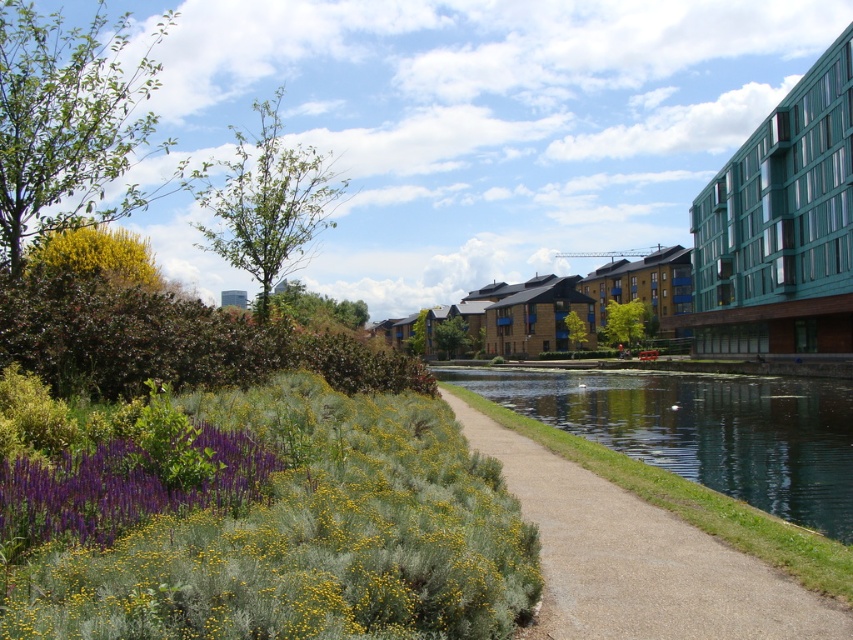
You are standing at the garden area on the left side of the park and want to reach the two points marked in the image. Which point, point (416, 564) or point (630, 605), is closer to you?

Point (416, 564) is closer to you than point (630, 605).

You are standing in the urban park and want to take a photo of the green fuzzy bush at lower left. If your camera has a maximum focus range of 30 feet, will you be able to capture it clearly?

The green fuzzy bush at lower left is 32.44 feet away from you, which exceeds the camera maximum focus range of 30 feet. Therefore, you won need to move closer to ensure the photo is clear.

You are standing at the center of the park and want to find the green fuzzy bush at lower left. Which direction should you face to locate it?

You should face the lower left direction to locate the green fuzzy bush at lower left.